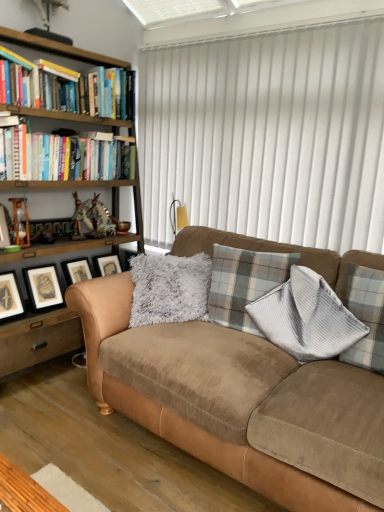
Question: Is plaid fabric pillow at center oriented away from wooden picture frame at left, marked as the first picture frame in a left-to-right arrangement?

Choices:
 (A) yes
 (B) no

Answer: (B)

Question: Does plaid fabric pillow at center lie in front of wooden picture frame at left, positioned as the first picture frame in top-to-bottom order?

Choices:
 (A) no
 (B) yes

Answer: (B)

Question: Does plaid fabric pillow at center come behind wooden picture frame at left, positioned as the first picture frame in top-to-bottom order?

Choices:
 (A) no
 (B) yes

Answer: (A)

Question: Would you say plaid fabric pillow at center is outside wooden picture frame at left, marked as the first picture frame in a left-to-right arrangement?

Choices:
 (A) no
 (B) yes

Answer: (B)

Question: Would you say plaid fabric pillow at center is a long distance from wooden picture frame at left, which appears as the 2th picture frame when viewed from the right?

Choices:
 (A) yes
 (B) no

Answer: (A)

Question: From their relative heights in the image, would you say wooden bookshelf at left is taller or shorter than hardcover books at left?

Choices:
 (A) tall
 (B) short

Answer: (A)

Question: From a real-world perspective, is wooden bookshelf at left positioned above or below hardcover books at left?

Choices:
 (A) above
 (B) below

Answer: (B)

Question: Considering the positions of wooden bookshelf at left and hardcover books at left in the image, is wooden bookshelf at left wider or thinner than hardcover books at left?

Choices:
 (A) wide
 (B) thin

Answer: (A)

Question: Is point (1, 257) closer or farther from the camera than point (44, 175)?

Choices:
 (A) closer
 (B) farther

Answer: (A)

Question: In terms of height, does plaid fabric pillow at center look taller or shorter compared to black matte picture frame at lower left, which ranks as the 1th picture frame in right-to-left order?

Choices:
 (A) tall
 (B) short

Answer: (A)

Question: Based on their sizes in the image, would you say plaid fabric pillow at center is bigger or smaller than black matte picture frame at lower left, which ranks as the 1th picture frame in right-to-left order?

Choices:
 (A) small
 (B) big

Answer: (B)

Question: From the image's perspective, relative to black matte picture frame at lower left, which ranks as the 1th picture frame in right-to-left order, is plaid fabric pillow at center above or below?

Choices:
 (A) below
 (B) above

Answer: (A)

Question: From a real-world perspective, relative to black matte picture frame at lower left, positioned as the first picture frame in back-to-front order, is plaid fabric pillow at center vertically above or below?

Choices:
 (A) above
 (B) below

Answer: (A)

Question: Looking at their shapes, would you say hardcover books at left is wider or thinner than wooden bookshelf at left?

Choices:
 (A) wide
 (B) thin

Answer: (B)

Question: Considering the positions of hardcover books at left and wooden bookshelf at left in the image, is hardcover books at left taller or shorter than wooden bookshelf at left?

Choices:
 (A) tall
 (B) short

Answer: (B)